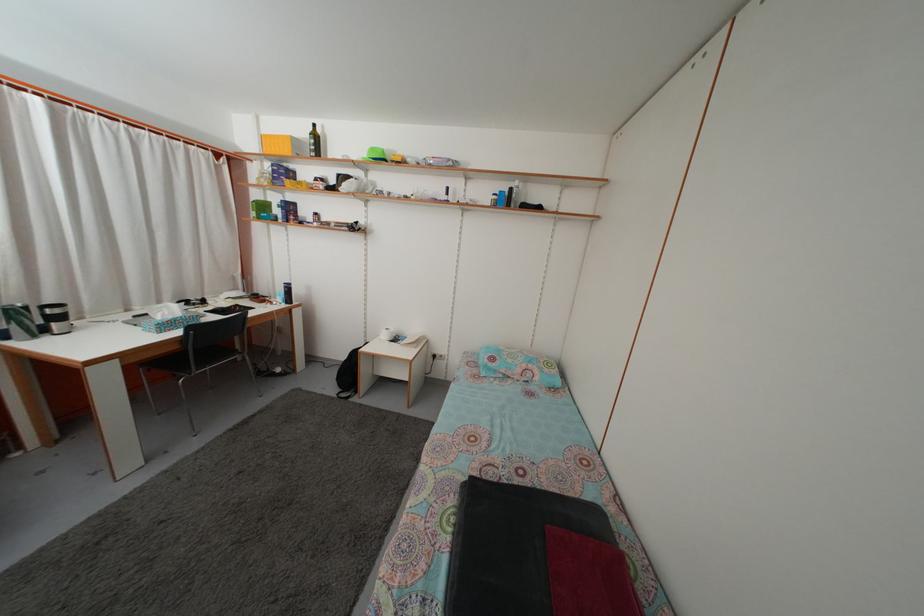
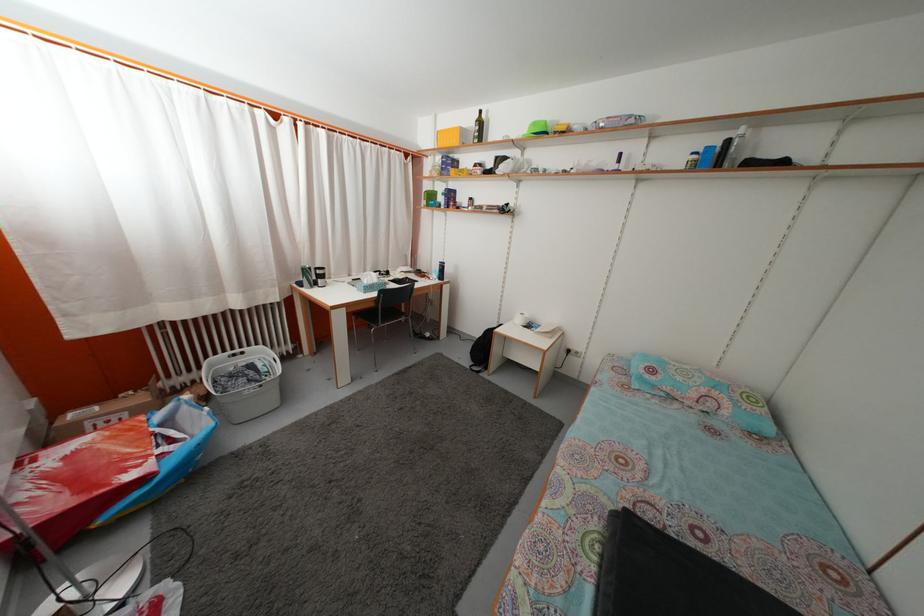
The point at (134, 318) is marked in the first image. Where is the corresponding point in the second image?

(355, 283)